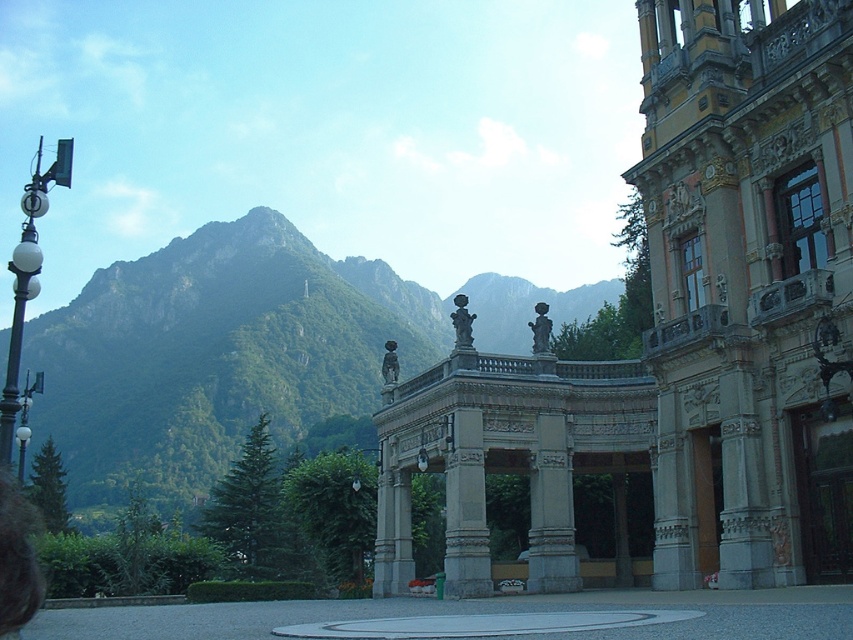
Can you confirm if green rocky mountain at upper left is wider than matte gray statue at center?

Yes, green rocky mountain at upper left is wider than matte gray statue at center.

Does green rocky mountain at upper left come behind matte gray statue at center?

No, it is in front of matte gray statue at center.

Is point (241, 230) positioned behind point (544, 344)?

Yes, point (241, 230) is farther from viewer.

Where is `green rocky mountain at upper left`? green rocky mountain at upper left is located at coordinates (218, 358).

Does gray stone archway at center have a smaller size compared to polished bronze door at center right?

No, gray stone archway at center is not smaller than polished bronze door at center right.

Is point (796, 512) in front of point (844, 458)?

No, it is behind (844, 458).

This screenshot has height=640, width=853. I want to click on gray stone archway at center, so click(672, 323).

Is matte black statue at center shorter than matte gray statue at center?

In fact, matte black statue at center may be taller than matte gray statue at center.

Which is in front, point (450, 314) or point (541, 349)?

Point (450, 314) is in front.

This screenshot has width=853, height=640. Find the location of `matte black statue at center`. matte black statue at center is located at coordinates (462, 323).